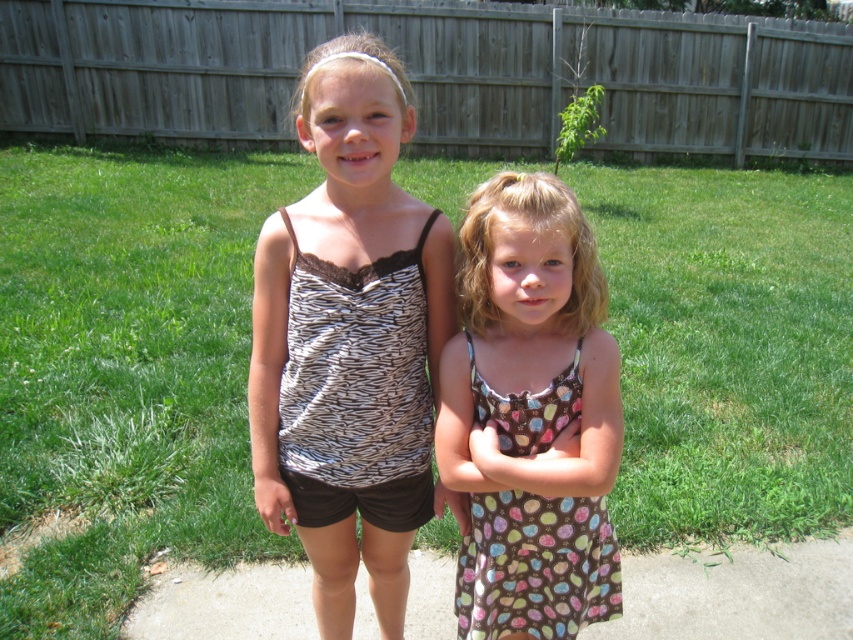
You are a photographer standing 2 meters away from the camera. You want to take a photo of the brown dotted dress at center. Can you move closer to the dress without exceeding the 2 meters distance limit?

The distance between the brown dotted dress at center and the camera is 1.54 meters. Since you are already 2 meters away from the camera, moving closer to the dress would require getting within 1.54 meters from the camera, which is within the 2 meters limit. Therefore, you can move closer to the brown dotted dress at center without exceeding the distance limit.